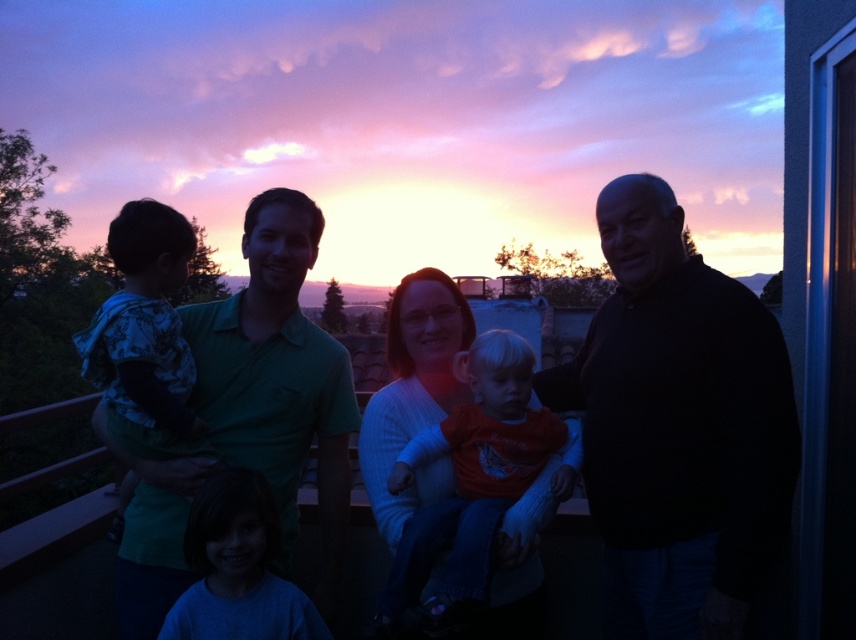
You are a photographer trying to capture the sunset. You notice two shirts in the foreground, a matte green shirt at left and a camouflage fabric shirt at left. Which shirt is taller and therefore more likely to block the view of the sunset if positioned closer to the camera?

The matte green shirt at left is taller than the camouflage fabric shirt at left, so it would block the view more if positioned closer to the camera.

You are standing on the balcony where the family is gathered. You notice the black knit sweater at right and the matte green shirt at left. Which one is positioned closer to the sunset in the background?

The black knit sweater at right is positioned closer to the sunset in the background because it is to the left of the matte green shirt at left, and the sunset is in the background behind them.